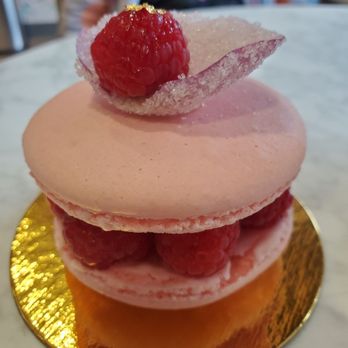
At what (x,y) coordinates should I click in order to perform the action: click on table. Please return your answer as a coordinate pair (x, y). The image size is (348, 348). Looking at the image, I should click on (326, 182), (29, 103), (307, 49).